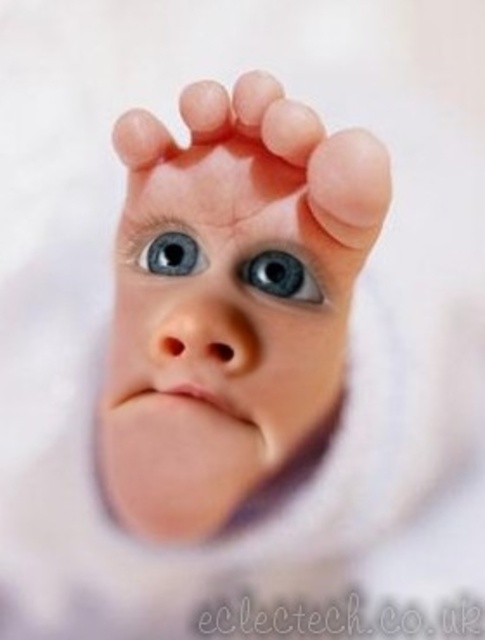
Is smooth flesh toe at upper center positioned at the back of blue glossy eye at center?

No, it is not.

Does smooth flesh toe at upper center have a smaller size compared to blue glossy eye at center?

Actually, smooth flesh toe at upper center might be larger than blue glossy eye at center.

Is point (369, 173) farther from viewer compared to point (312, 301)?

No, it is in front of (312, 301).

At what (x,y) coordinates should I click in order to perform the action: click on smooth flesh toe at upper center. Please return your answer as a coordinate pair (x, y). Looking at the image, I should click on (349, 186).

Is smooth skin face at center below smooth flesh toe at upper center?

Correct, smooth skin face at center is located below smooth flesh toe at upper center.

Is smooth skin face at center taller than smooth flesh toe at upper center?

Yes, smooth skin face at center is taller than smooth flesh toe at upper center.

Locate an element on the screen. Image resolution: width=485 pixels, height=640 pixels. smooth skin face at center is located at coordinates (217, 339).

Locate an element on the screen. The height and width of the screenshot is (640, 485). pink smooth toe at center is located at coordinates (291, 131).

Between pink smooth toe at center and pink flesh at upper center, which one has more height?

pink smooth toe at center

Who is more forward, [262,134] or [158,148]?

Point [262,134] is in front.

Locate an element on the screen. The image size is (485, 640). pink smooth toe at center is located at coordinates (291, 131).